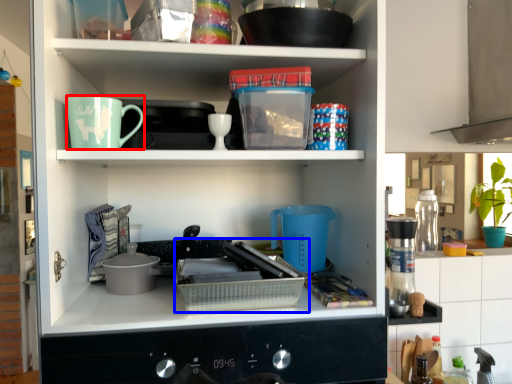
Question: Which point is further to the camera, coffee cup (highlighted by a red box) or appliance (highlighted by a blue box)?

Choices:
 (A) coffee cup
 (B) appliance

Answer: (A)